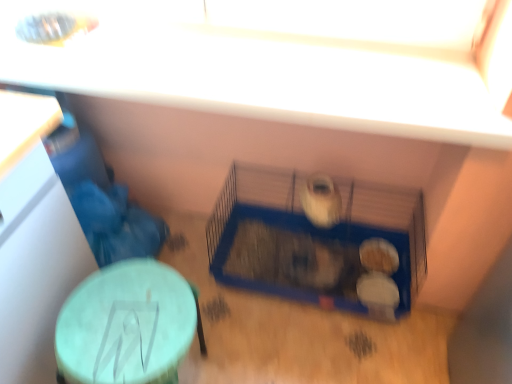
Image resolution: width=512 pixels, height=384 pixels. What are the coordinates of `free space in front of blue wire bird cage at center` in the screenshot? It's located at (312, 348).